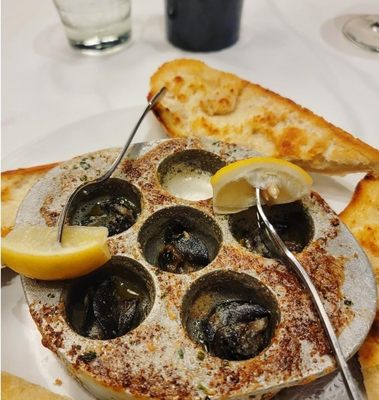
Locate an element on the screen. white table cloth is located at coordinates (68, 91).